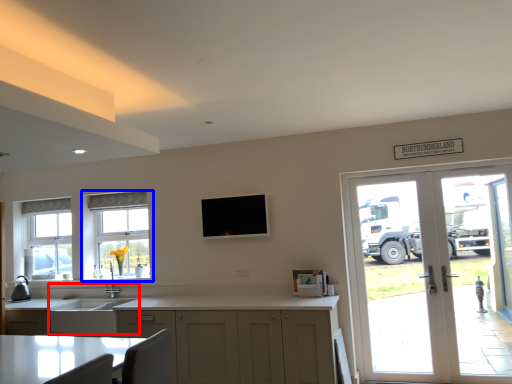
Question: Which point is closer to the camera, sink (highlighted by a red box) or window (highlighted by a blue box)?

Choices:
 (A) sink
 (B) window

Answer: (A)